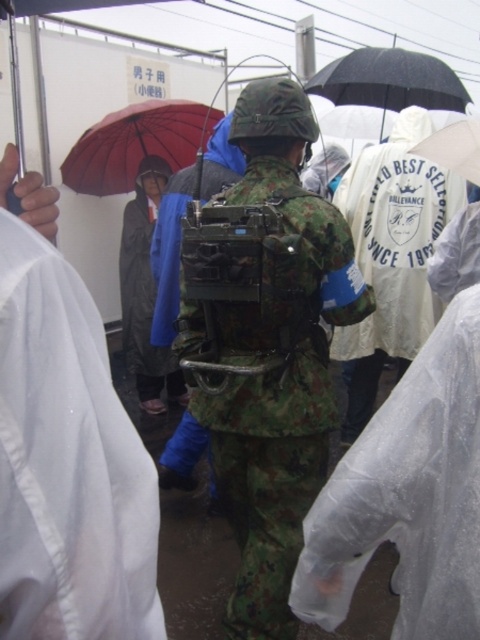
You are a photographer trying to capture a closeup of the red matte umbrella at upper left and the black matte umbrella at upper center. Since you want to focus on the red one, should you choose a wide angle lens or a telephoto lens?

The red matte umbrella at upper left is smaller in width than the black matte umbrella at upper center. To focus on the smaller red matte umbrella at upper left, you should use a telephoto lens to zoom in and capture details without including too much of the surrounding scene.

You are a delivery person trying to decide which item to carry first. You see the camouflage fabric backpack at center and the white matte umbrella at upper center. Which item is larger in size?

The camouflage fabric backpack at center is bigger than the white matte umbrella at upper center, so you should carry the camouflage fabric backpack at center first as it requires more space.